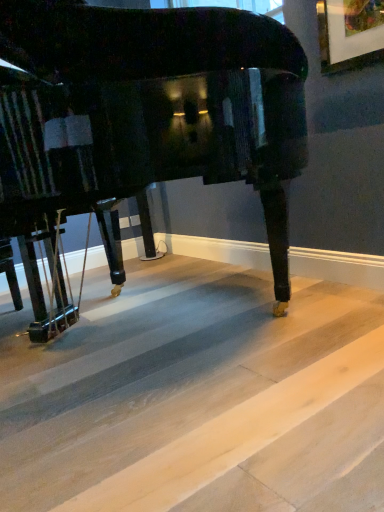
Question: Is glossy black piano at center taller than light wood flooring at lower center?

Choices:
 (A) yes
 (B) no

Answer: (A)

Question: Considering the relative sizes of glossy black piano at center and light wood flooring at lower center in the image provided, is glossy black piano at center bigger than light wood flooring at lower center?

Choices:
 (A) no
 (B) yes

Answer: (B)

Question: Can you confirm if glossy black piano at center is smaller than light wood flooring at lower center?

Choices:
 (A) yes
 (B) no

Answer: (B)

Question: From the image's perspective, is glossy black piano at center located above light wood flooring at lower center?

Choices:
 (A) no
 (B) yes

Answer: (B)

Question: Is glossy black piano at center facing towards light wood flooring at lower center?

Choices:
 (A) no
 (B) yes

Answer: (A)

Question: From a real-world perspective, is glossy black piano at center under light wood flooring at lower center?

Choices:
 (A) no
 (B) yes

Answer: (A)

Question: From the image's perspective, is light wood flooring at lower center located beneath glossy black piano at center?

Choices:
 (A) no
 (B) yes

Answer: (B)

Question: Is light wood flooring at lower center at the right side of glossy black piano at center?

Choices:
 (A) no
 (B) yes

Answer: (B)

Question: From a real-world perspective, is light wood flooring at lower center on glossy black piano at center?

Choices:
 (A) no
 (B) yes

Answer: (A)

Question: Considering the relative sizes of light wood flooring at lower center and glossy black piano at center in the image provided, is light wood flooring at lower center smaller than glossy black piano at center?

Choices:
 (A) no
 (B) yes

Answer: (B)

Question: Does light wood flooring at lower center come in front of glossy black piano at center?

Choices:
 (A) no
 (B) yes

Answer: (B)

Question: Would you consider light wood flooring at lower center to be distant from glossy black piano at center?

Choices:
 (A) no
 (B) yes

Answer: (A)

Question: From the image's perspective, is glossy black piano at center positioned above or below light wood flooring at lower center?

Choices:
 (A) below
 (B) above

Answer: (B)